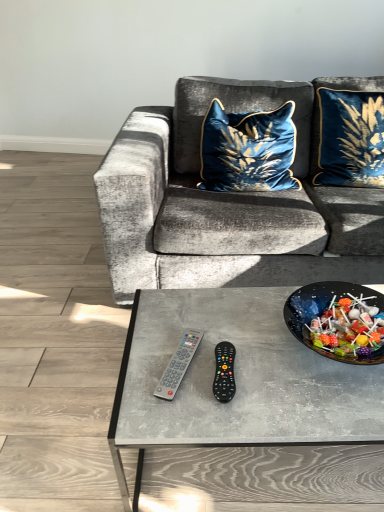
Question: Can you confirm if black plastic remote at center is smaller than gray plastic remote at center?

Choices:
 (A) yes
 (B) no

Answer: (B)

Question: Would you consider black plastic remote at center to be distant from gray plastic remote at center?

Choices:
 (A) no
 (B) yes

Answer: (A)

Question: Is black plastic remote at center facing away from gray plastic remote at center?

Choices:
 (A) yes
 (B) no

Answer: (B)

Question: Considering the relative positions of black plastic remote at center and gray plastic remote at center in the image provided, is black plastic remote at center to the left of gray plastic remote at center from the viewer's perspective?

Choices:
 (A) yes
 (B) no

Answer: (B)

Question: From a real-world perspective, is black plastic remote at center over gray plastic remote at center?

Choices:
 (A) yes
 (B) no

Answer: (A)

Question: In the image, is black plastic remote at center positioned in front of or behind velvet blue cushion at center, which is counted as the 1th pillow, starting from the left?

Choices:
 (A) front
 (B) behind

Answer: (A)

Question: From the image's perspective, is black plastic remote at center located above or below velvet blue cushion at center, which is counted as the 1th pillow, starting from the left?

Choices:
 (A) above
 (B) below

Answer: (B)

Question: Considering the positions of point (215, 351) and point (208, 160), is point (215, 351) closer or farther from the camera than point (208, 160)?

Choices:
 (A) farther
 (B) closer

Answer: (B)

Question: Based on their sizes in the image, would you say black plastic remote at center is bigger or smaller than velvet blue cushion at center, which is counted as the 1th pillow, starting from the left?

Choices:
 (A) big
 (B) small

Answer: (B)

Question: From the image's perspective, is shiny black bowl at center positioned above or below velvet blue cushion at center, placed as the second pillow when sorted from right to left?

Choices:
 (A) below
 (B) above

Answer: (A)

Question: In the image, is shiny black bowl at center on the left side or the right side of velvet blue cushion at center, placed as the second pillow when sorted from right to left?

Choices:
 (A) left
 (B) right

Answer: (B)

Question: In terms of height, does shiny black bowl at center look taller or shorter compared to velvet blue cushion at center, which is counted as the 1th pillow, starting from the left?

Choices:
 (A) tall
 (B) short

Answer: (B)

Question: Considering the positions of point (362, 351) and point (215, 172), is point (362, 351) closer or farther from the camera than point (215, 172)?

Choices:
 (A) closer
 (B) farther

Answer: (A)

Question: Considering their positions, is gray plastic remote at center located in front of or behind velvet blue pillow at upper right, positioned as the second pillow in left-to-right order?

Choices:
 (A) behind
 (B) front

Answer: (B)

Question: From a real-world perspective, is gray plastic remote at center physically located above or below velvet blue pillow at upper right, positioned as the second pillow in left-to-right order?

Choices:
 (A) below
 (B) above

Answer: (A)